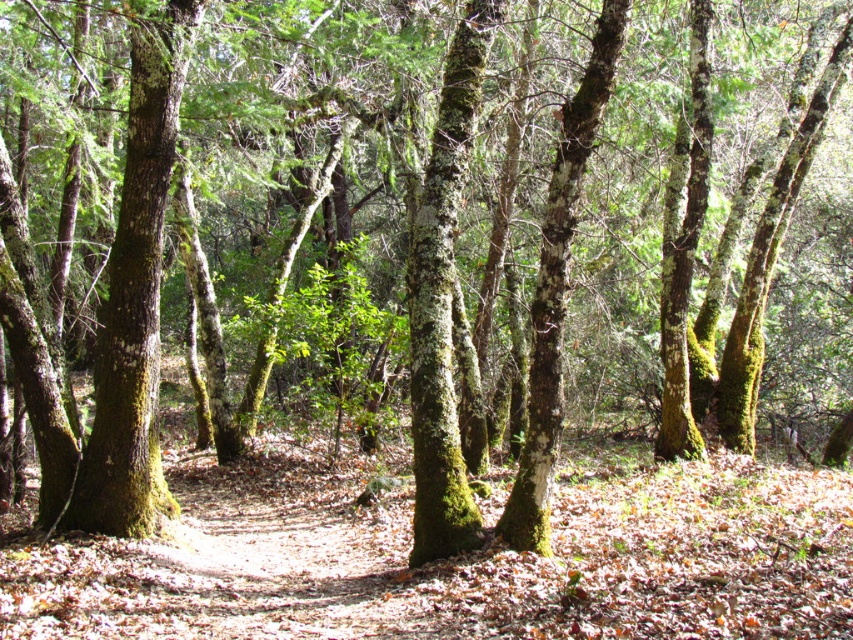
You are standing in the forest depicted in the scene. There is a point marked at coordinates (135, 296). What object is located at that point?

The point at coordinates (135, 296) corresponds to the green mossy tree trunk at left.

You are a hiker who wants to take a photo of both the green mossy tree trunk at left and the green mossy tree trunk at center. Since you want both in the frame, can you determine if you can capture them in a single photo without moving your camera?

The green mossy tree trunk at left is located above the green mossy tree trunk at center, so you can capture both in a single photo by adjusting the camera angle to include both the upper and lower positions of the tree trunks.